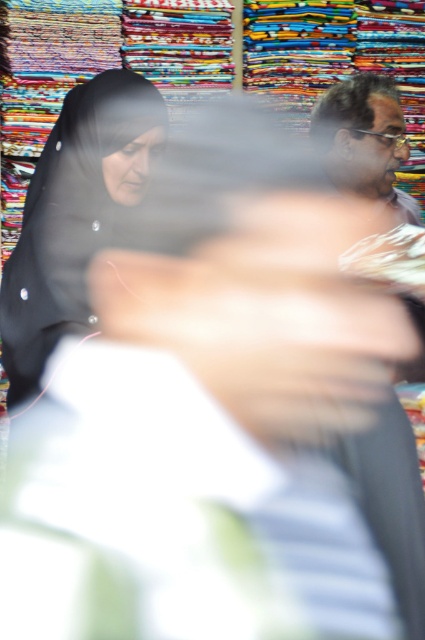
Which is behind, point (59, 170) or point (365, 125)?

The point (365, 125) is more distant.

Can you confirm if matte black headscarf at left is positioned above matte gray shirt at upper right?

No, matte black headscarf at left is not above matte gray shirt at upper right.

Consider the image. Who is more distant from viewer, (65,276) or (362,118)?

Positioned behind is point (362,118).

In order to click on matte black headscarf at left in this screenshot , I will do `click(73, 216)`.